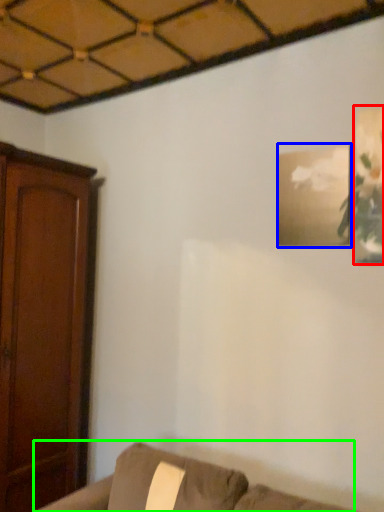
Question: Which is nearer to the picture frame (highlighted by a red box)? picture frame (highlighted by a blue box) or furniture (highlighted by a green box).

Choices:
 (A) picture frame
 (B) furniture

Answer: (A)